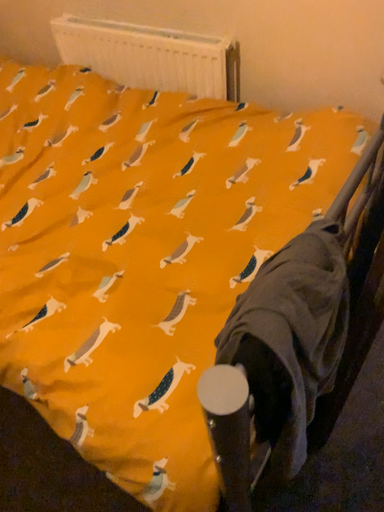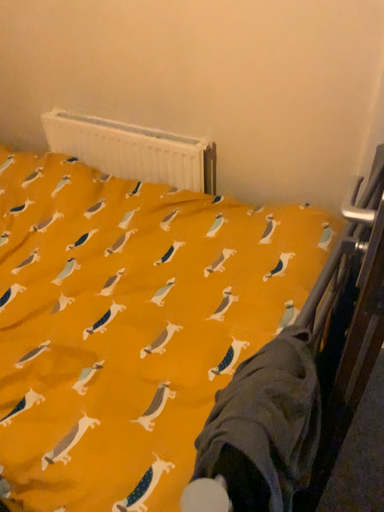
Question: Which way did the camera rotate in the video?

Choices:
 (A) rotated downward
 (B) rotated upward

Answer: (B)